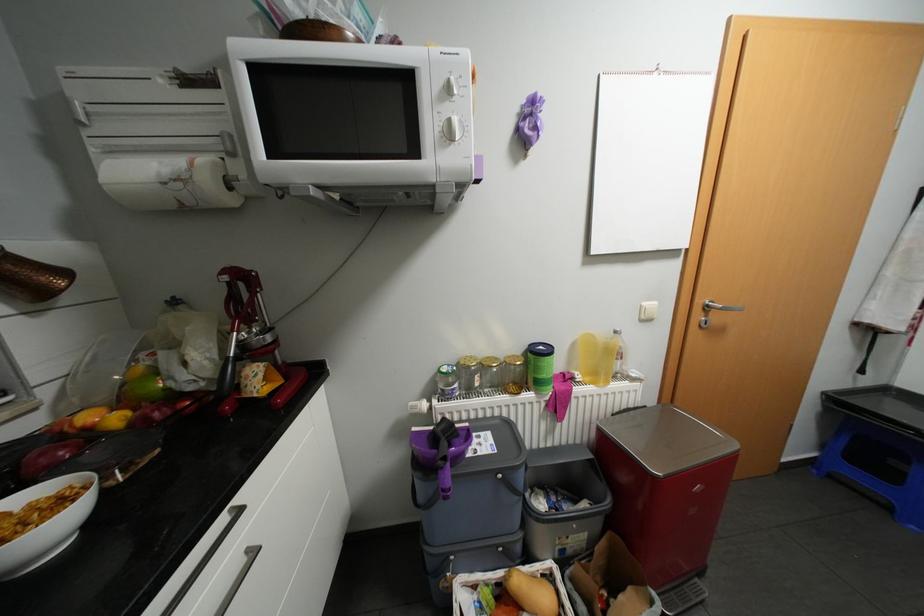
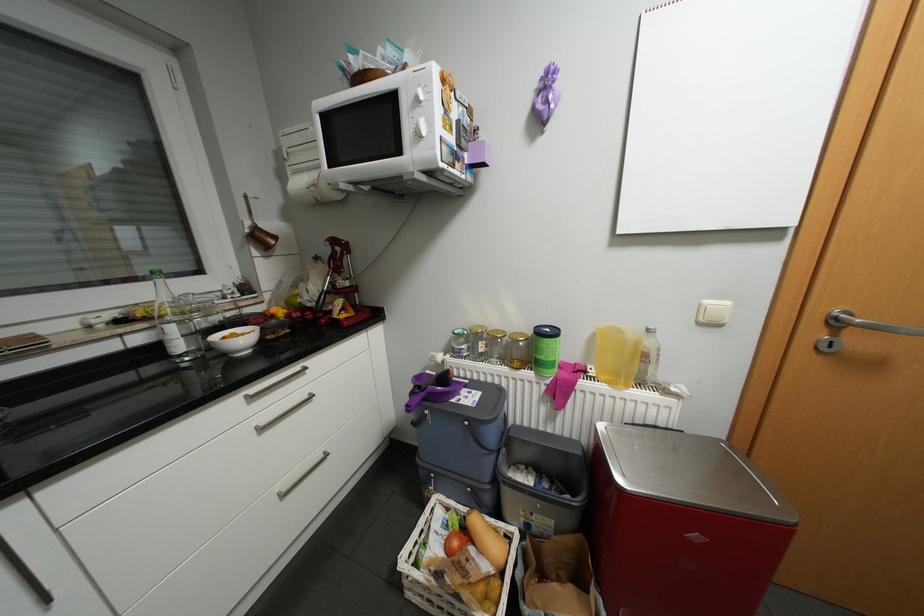
The point at (x=541, y=575) is marked in the first image. Where is the corresponding point in the second image?

(504, 528)